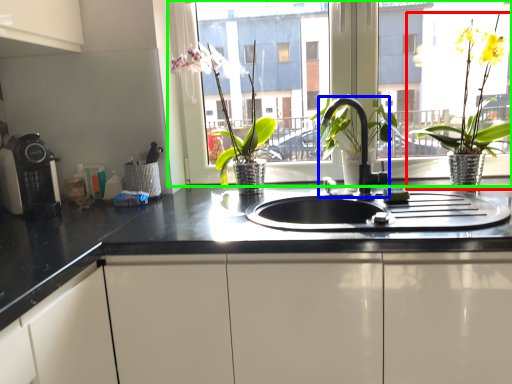
Question: Which is nearer to the houseplant (highlighted by a red box)? tap (highlighted by a blue box) or window (highlighted by a green box).

Choices:
 (A) tap
 (B) window

Answer: (A)